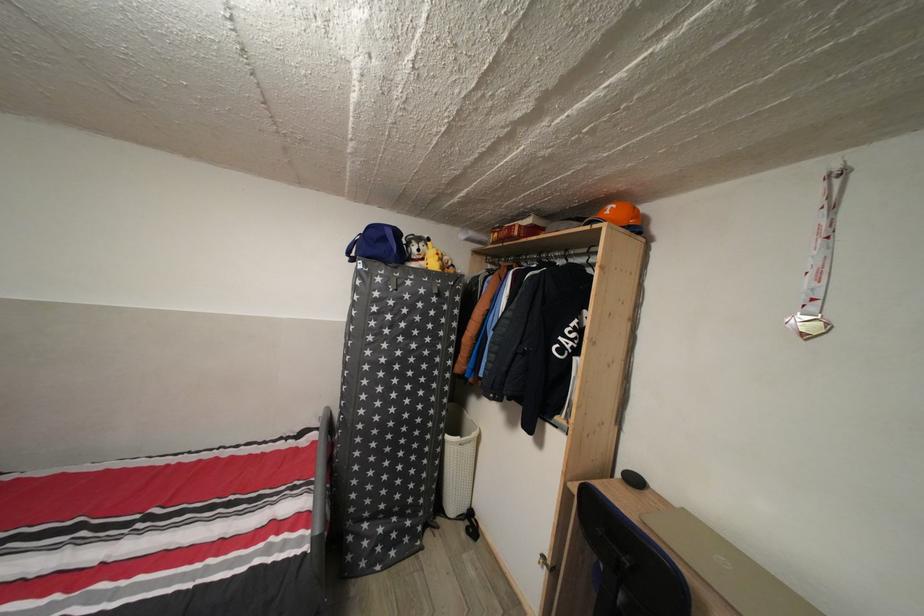
In order to click on orange baseball cap in this screenshot , I will do `click(618, 216)`.